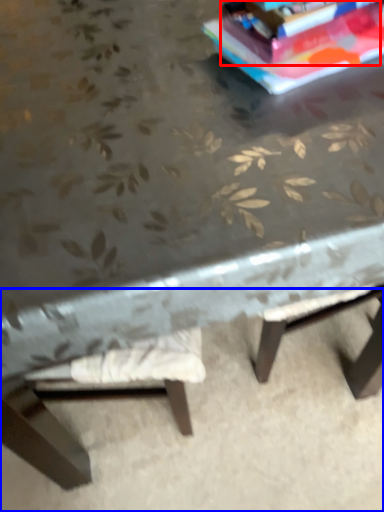
Question: Which point is closer to the camera, paperback book (highlighted by a red box) or concrete (highlighted by a blue box)?

Choices:
 (A) paperback book
 (B) concrete

Answer: (A)